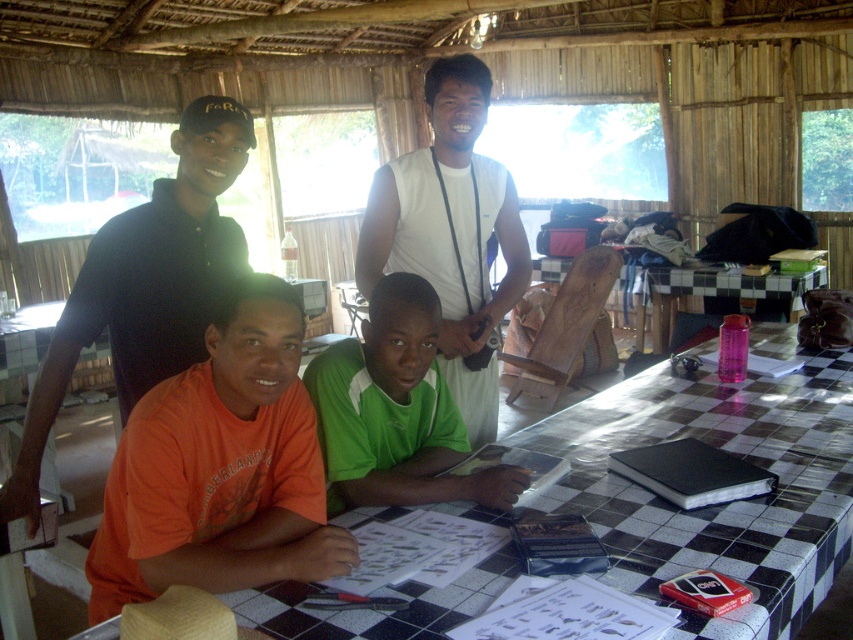
Question: Which object is the closest to the green jersey at center?

Choices:
 (A) checkerboard-patterned table at center
 (B) orange cotton shirt at lower left

Answer: (B)

Question: Where is orange cotton shirt at lower left located in relation to white matte shirt at upper center in the image?

Choices:
 (A) below
 (B) above

Answer: (A)

Question: Which object is positioned closest to the orange cotton shirt at lower left?

Choices:
 (A) green jersey at center
 (B) matte black polo shirt at upper left

Answer: (A)

Question: Is matte black polo shirt at upper left to the left of pink plastic water bottle at center from the viewer's perspective?

Choices:
 (A) no
 (B) yes

Answer: (B)

Question: From the image, what is the correct spatial relationship of green jersey at center in relation to pink plastic water bottle at center?

Choices:
 (A) left
 (B) right

Answer: (A)

Question: Which of these objects is positioned closest to the green jersey at center?

Choices:
 (A) matte black polo shirt at upper left
 (B) orange cotton shirt at lower left

Answer: (B)